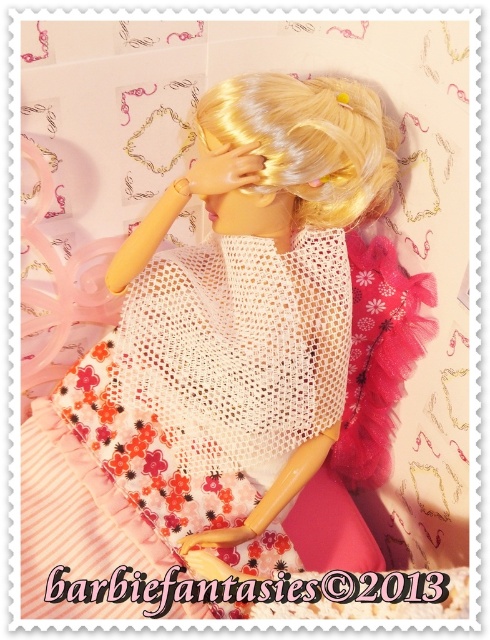
Question: Does white mesh dress at center have a greater width compared to blonde silky hair at center?

Choices:
 (A) yes
 (B) no

Answer: (A)

Question: Which point is farther to the camera?

Choices:
 (A) (340, 180)
 (B) (128, 554)

Answer: (B)

Question: Is white mesh dress at center to the right of blonde silky hair at center from the viewer's perspective?

Choices:
 (A) yes
 (B) no

Answer: (B)

Question: Does white mesh dress at center appear over blonde silky hair at center?

Choices:
 (A) no
 (B) yes

Answer: (A)

Question: Which of the following is the closest to the observer?

Choices:
 (A) white mesh dress at center
 (B) blonde silky hair at center

Answer: (B)

Question: Which point is closer to the camera?

Choices:
 (A) (344, 112)
 (B) (205, 422)

Answer: (A)